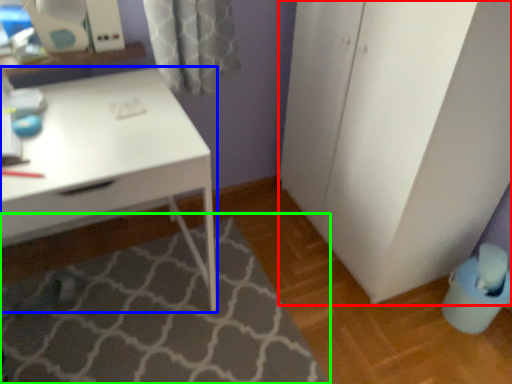
Question: Which object is the farthest from file cabinet (highlighted by a red box)? Choose among these: desk (highlighted by a blue box) or bath mat (highlighted by a green box).

Choices:
 (A) desk
 (B) bath mat

Answer: (B)